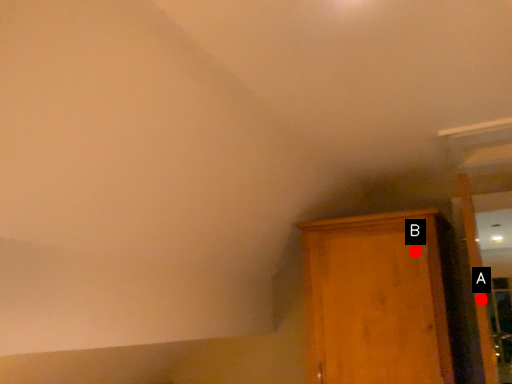
Question: Two points are circled on the image, labeled by A and B beside each circle. Which point appears farthest from the camera in this image?

Choices:
 (A) A is further
 (B) B is further

Answer: (A)